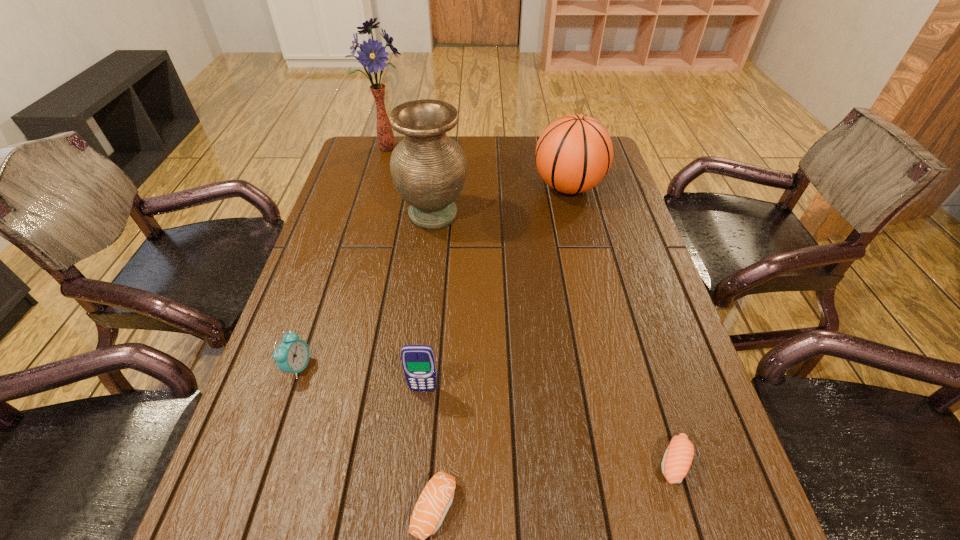
Identify the location of flower arrangement. The width and height of the screenshot is (960, 540). (372, 55).

Identify the location of the tallest object. (372, 55).

Identify the location of the second tallest object. (428, 168).

Identify the location of basketball. (574, 153).

Locate an element on the screen. cellular telephone is located at coordinates (418, 361).

Where is `the third nearest object`? The height and width of the screenshot is (540, 960). the third nearest object is located at coordinates (418, 361).

I want to click on alarm clock, so click(292, 356).

Where is `the third shortest object`? The image size is (960, 540). the third shortest object is located at coordinates (292, 356).

Locate an element on the screen. This screenshot has width=960, height=540. the right sushi is located at coordinates (678, 457).

Identify the location of free space located 0.300m on the front of the farthest object. (369, 212).